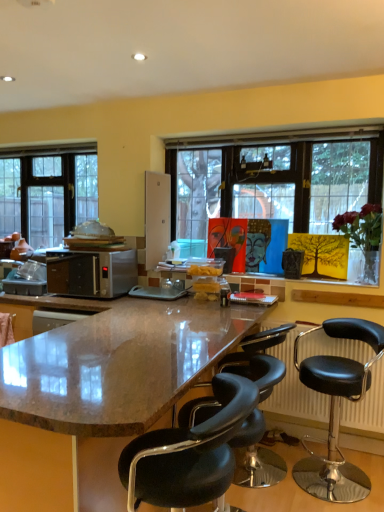
I want to click on black leather bar stool at center, which is the first chair in back-to-front order, so click(x=259, y=360).

Where is `black leather stool at center, which is counted as the third chair, starting from the back`? The width and height of the screenshot is (384, 512). black leather stool at center, which is counted as the third chair, starting from the back is located at coordinates (188, 453).

Measure the distance between clear glass window at left and camera.

They are 11.65 feet apart.

Find the location of a particular element. This screenshot has height=512, width=384. black leather stool at lower right, the 2th chair from the front is located at coordinates (337, 409).

From the image's perspective, which one is positioned lower, shiny granite countertop at center or black leather radiator at lower right?

shiny granite countertop at center appears lower in the image.

Looking at this image, measure the distance between shiny granite countertop at center and black leather radiator at lower right.

shiny granite countertop at center is 37.50 inches from black leather radiator at lower right.

Considering the sizes of shiny granite countertop at center and black leather radiator at lower right in the image, is shiny granite countertop at center taller or shorter than black leather radiator at lower right?

Considering their sizes, shiny granite countertop at center has more height than black leather radiator at lower right.

From a real-world perspective, who is located lower, shiny granite countertop at center or black leather radiator at lower right?

From a 3D spatial view, shiny granite countertop at center is below.

Based on the photo, does clear glass window at left have a greater width compared to shiny granite countertop at center?

Incorrect, the width of clear glass window at left does not surpass that of shiny granite countertop at center.

Does clear glass window at left lie in front of shiny granite countertop at center?

No, it is not.

The height and width of the screenshot is (512, 384). Find the location of `countertop that appears below the clear glass window at left (from the image's perspective)`. countertop that appears below the clear glass window at left (from the image's perspective) is located at coordinates (118, 365).

Does shiny granite countertop at center have a greater height compared to satin silver microwave at center?

Indeed, shiny granite countertop at center has a greater height compared to satin silver microwave at center.

Is shiny granite countertop at center turned away from satin silver microwave at center?

No.

Considering the positions of points (333, 465) and (244, 430), is point (333, 465) farther from camera compared to point (244, 430)?

That is True.

Looking at this image, considering the relative positions of black leather stool at lower right, the 2th chair from the front, and black leather bar stool at center, arranged as the 3th chair when viewed from the front, in the image provided, is black leather stool at lower right, the 2th chair from the front, to the right of black leather bar stool at center, arranged as the 3th chair when viewed from the front, from the viewer's perspective?

Correct, you'll find black leather stool at lower right, the 2th chair from the front, to the right of black leather bar stool at center, arranged as the 3th chair when viewed from the front.

From a real-world perspective, is black leather stool at lower right, arranged as the second chair when viewed from the back, over black leather bar stool at center, arranged as the 3th chair when viewed from the front?

Correct, in the physical world, black leather stool at lower right, arranged as the second chair when viewed from the back, is higher than black leather bar stool at center, arranged as the 3th chair when viewed from the front.

Is black leather stool at lower right, arranged as the second chair when viewed from the back, positioned far away from clear glass window at left?

Indeed, black leather stool at lower right, arranged as the second chair when viewed from the back, is not near clear glass window at left.

From a real-world perspective, is black leather stool at lower right, the 2th chair from the front, on clear glass window at left?

No, from a real-world perspective, black leather stool at lower right, the 2th chair from the front, is not above clear glass window at left.

Does black leather stool at lower right, the 2th chair from the front, lie behind clear glass window at left?

No, it is not.

From the image's perspective, is shiny granite countertop at center over black leather stool at lower right, the 2th chair from the front?

No, from the image's perspective, shiny granite countertop at center is not above black leather stool at lower right, the 2th chair from the front.

Which is closer, (44, 400) or (340, 377)?

Clearly, point (44, 400) is closer to the camera than point (340, 377).

Considering the sizes of objects shiny granite countertop at center and black leather stool at lower right, arranged as the second chair when viewed from the back, in the image provided, who is wider, shiny granite countertop at center or black leather stool at lower right, arranged as the second chair when viewed from the back,?

Wider between the two is shiny granite countertop at center.

Between shiny granite countertop at center and black leather stool at lower right, the 2th chair from the front, which one has smaller size?

black leather stool at lower right, the 2th chair from the front.

Considering the relative sizes of satin silver microwave at center and clear glass window at left in the image provided, is satin silver microwave at center shorter than clear glass window at left?

Correct, satin silver microwave at center is not as tall as clear glass window at left.

Based on their positions, is satin silver microwave at center located to the left or right of clear glass window at left?

satin silver microwave at center is positioned on clear glass window at left's right side.

Is point (61, 292) positioned in front of point (15, 200)?

Yes.

From the image's perspective, is satin silver microwave at center above clear glass window at left?

Actually, satin silver microwave at center appears below clear glass window at left in the image.

Where is `countertop lying on the left of black leather radiator at lower right`? This screenshot has height=512, width=384. countertop lying on the left of black leather radiator at lower right is located at coordinates (118, 365).

Where is `countertop on the right of clear glass window at left`? Image resolution: width=384 pixels, height=512 pixels. countertop on the right of clear glass window at left is located at coordinates tap(118, 365).

When comparing their distances from black leather stool at center, which is counted as the third chair, starting from the back, does shiny granite countertop at center or black leather bar stool at center, arranged as the 3th chair when viewed from the front, seem closer?

Among the two, shiny granite countertop at center is located nearer to black leather stool at center, which is counted as the third chair, starting from the back.

Which object lies nearer to the anchor point black leather bar stool at center, arranged as the 3th chair when viewed from the front, shiny granite countertop at center or clear glass window at left?

Based on the image, shiny granite countertop at center appears to be nearer to black leather bar stool at center, arranged as the 3th chair when viewed from the front.

Looking at the image, which one is located closer to black leather bar stool at center, which is the first chair in back-to-front order, black leather radiator at lower right or shiny granite countertop at center?

The object closer to black leather bar stool at center, which is the first chair in back-to-front order, is black leather radiator at lower right.

In the scene shown: Considering their positions, is satin silver microwave at center positioned closer to black leather stool at center, which is counted as the third chair, starting from the back, than shiny granite countertop at center?

shiny granite countertop at center is positioned closer to the anchor black leather stool at center, which is counted as the third chair, starting from the back.

When comparing their distances from black leather stool at lower right, arranged as the second chair when viewed from the back, does black leather bar stool at center, arranged as the 3th chair when viewed from the front, or shiny granite countertop at center seem closer?

black leather bar stool at center, arranged as the 3th chair when viewed from the front, is closer to black leather stool at lower right, arranged as the second chair when viewed from the back.

From the image, which object appears to be farther from black leather bar stool at center, arranged as the 3th chair when viewed from the front, black leather stool at center, which is counted as the third chair, starting from the back, or clear glass window at left?

clear glass window at left is positioned further to the anchor black leather bar stool at center, arranged as the 3th chair when viewed from the front.

When comparing their distances from black leather bar stool at center, which is the first chair in back-to-front order, does black leather radiator at lower right or black leather stool at center, which is counted as the third chair, starting from the back, seem further?

black leather radiator at lower right is positioned further to the anchor black leather bar stool at center, which is the first chair in back-to-front order.

Based on their spatial positions, is black leather bar stool at center, arranged as the 3th chair when viewed from the front, or clear glass window at left further from black leather radiator at lower right?

clear glass window at left is positioned further to the anchor black leather radiator at lower right.

I want to click on microwave oven situated between clear glass window at left and black leather stool at lower right, the 2th chair from the front, from left to right, so click(x=92, y=273).

Locate an element on the screen. Image resolution: width=384 pixels, height=512 pixels. countertop positioned between black leather stool at center, which is counted as the third chair, starting from the back, and black leather bar stool at center, arranged as the 3th chair when viewed from the front, from near to far is located at coordinates (118, 365).

I want to click on microwave oven between clear glass window at left and black leather radiator at lower right from left to right, so click(x=92, y=273).

Identify the location of microwave oven located between shiny granite countertop at center and clear glass window at left in the depth direction. The image size is (384, 512). (92, 273).